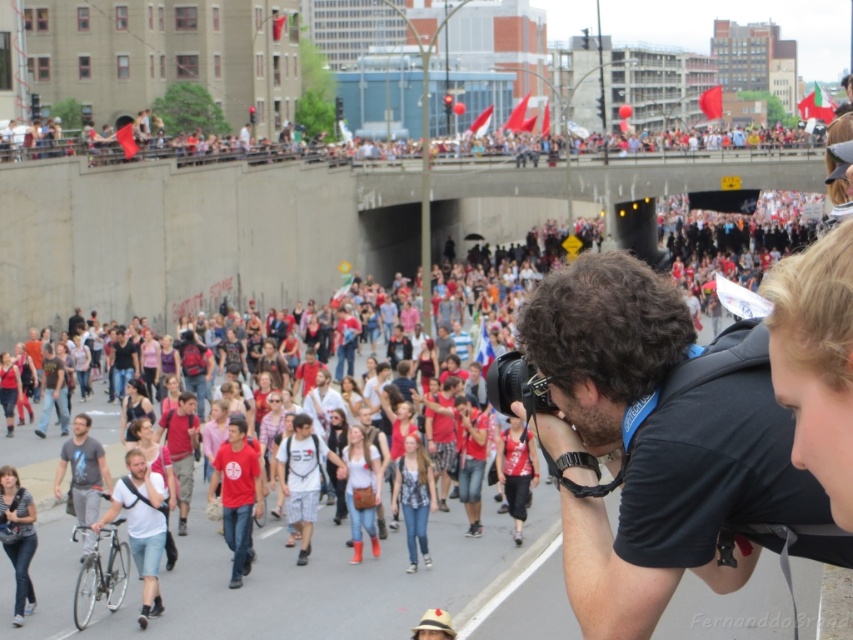
Does black fabric camera at center have a greater height compared to matte red shirts at upper center?

No.

Who is shorter, black fabric camera at center or matte red shirts at upper center?

black fabric camera at center

Find the location of `black fabric camera at center`. black fabric camera at center is located at coordinates (654, 444).

Does matte red shirts at upper center appear under gray cotton t-shirt at center?

No, matte red shirts at upper center is not below gray cotton t-shirt at center.

You are a GUI agent. You are given a task and a screenshot of the screen. Output one action in this format:
    pyautogui.click(x=<x>, y=<y>)
    Task: Click on the matte red shirts at upper center
    The height and width of the screenshot is (640, 853).
    Given the screenshot: What is the action you would take?
    pyautogui.click(x=236, y=150)

Between black fabric camera at center and gray cotton t-shirt at center, which one appears on the left side from the viewer's perspective?

From the viewer's perspective, gray cotton t-shirt at center appears more on the left side.

Who is taller, black fabric camera at center or gray cotton t-shirt at center?

Standing taller between the two is black fabric camera at center.

Which is in front, point (757, 486) or point (80, 476)?

Positioned in front is point (757, 486).

This screenshot has width=853, height=640. In order to click on black fabric camera at center in this screenshot , I will do `click(654, 444)`.